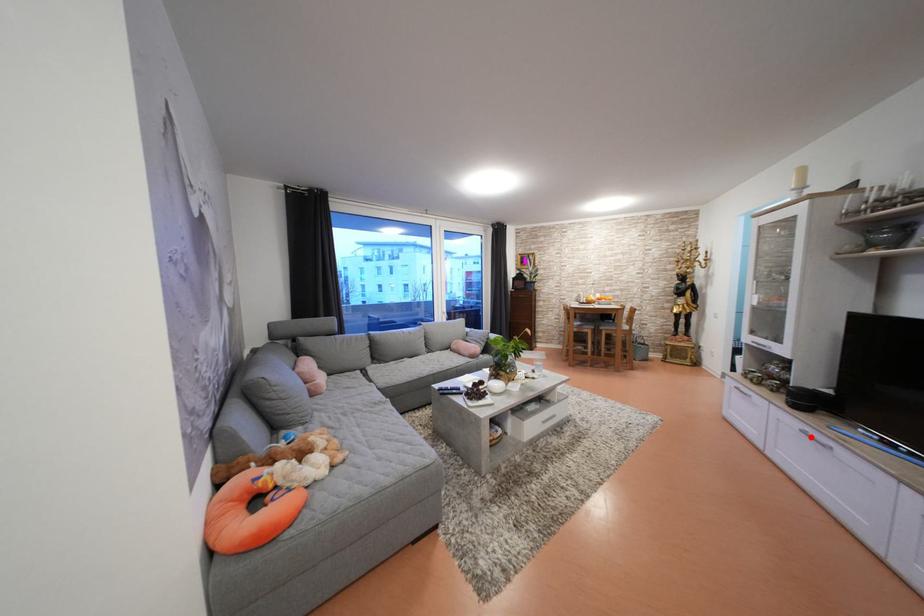
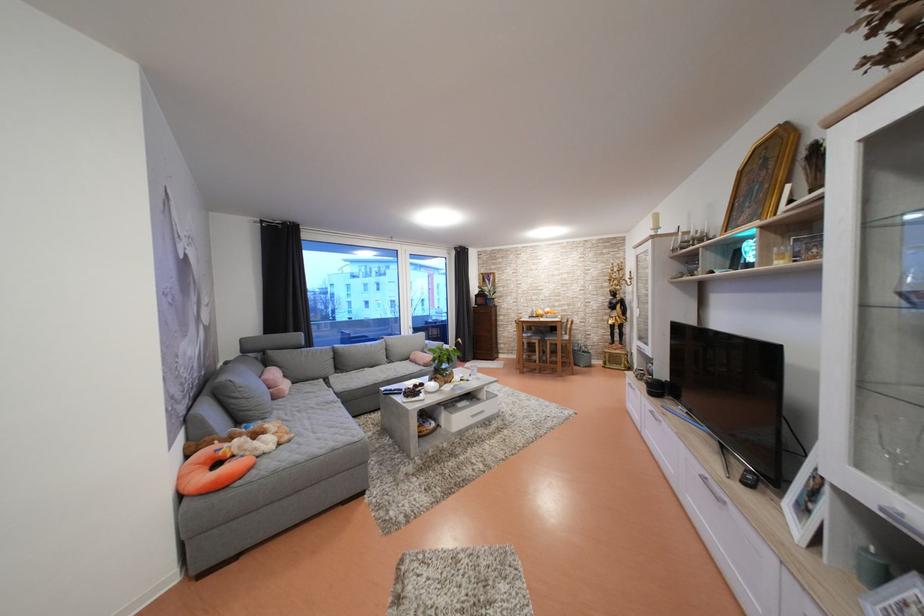
The point at the highlighted location is marked in the first image. Where is the corresponding point in the second image?

(659, 416)